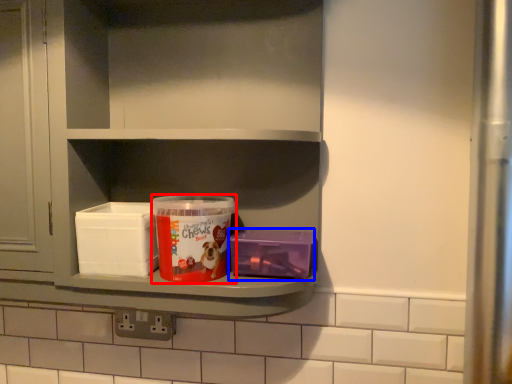
Question: Which object is closer to the camera taking this photo, product (highlighted by a red box) or box (highlighted by a blue box)?

Choices:
 (A) product
 (B) box

Answer: (A)